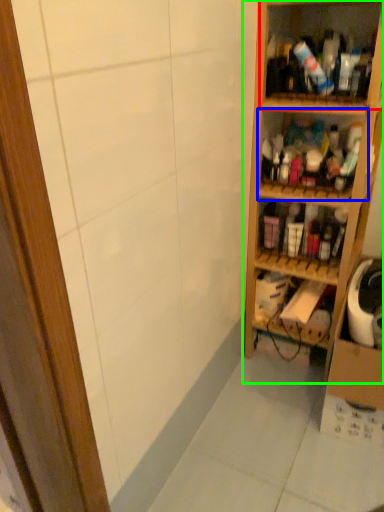
Question: Which object is positioned closest to shelf (highlighted by a red box)? Select from shelf (highlighted by a blue box) and shelf (highlighted by a green box).

Choices:
 (A) shelf
 (B) shelf

Answer: (B)